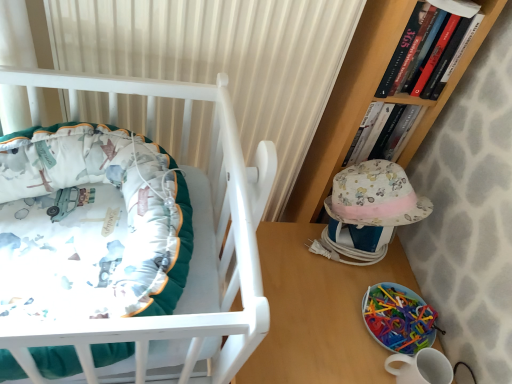
Identify the location of free region on the left part of translucent plastic toy at lower right. This screenshot has width=512, height=384. (323, 292).